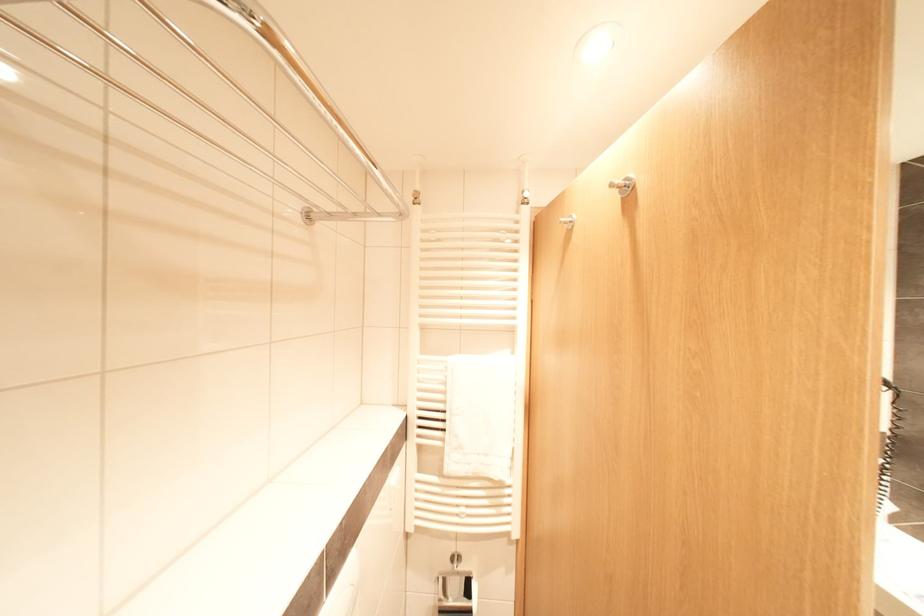
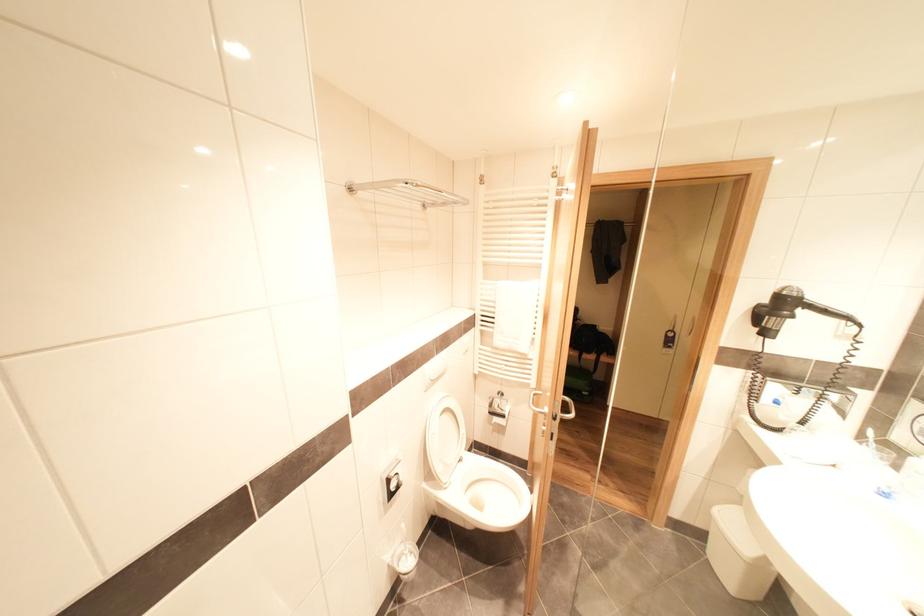
The images are taken continuously from a first-person perspective. In which direction are you moving?

The cameraman walked toward right, backward.